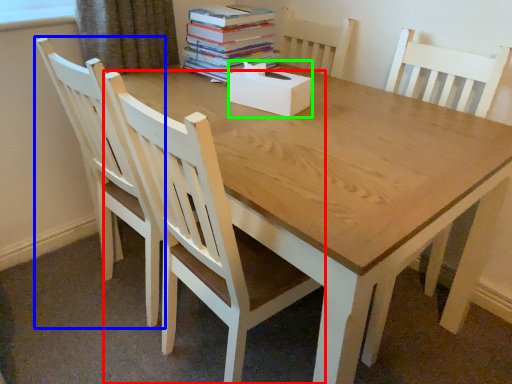
Question: Considering the real-world distances, which object is closest to chair (highlighted by a red box)? chair (highlighted by a blue box) or box (highlighted by a green box).

Choices:
 (A) chair
 (B) box

Answer: (A)